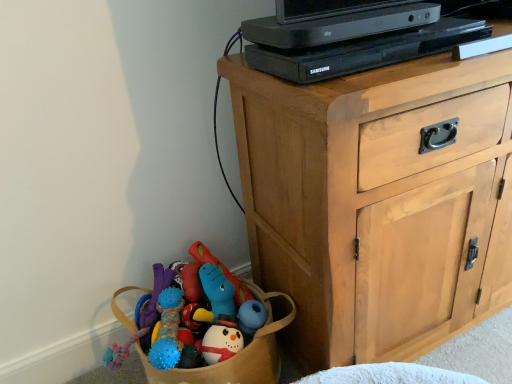
This screenshot has width=512, height=384. Describe the element at coordinates (351, 37) in the screenshot. I see `black plastic computer at upper center` at that location.

Identify the location of black plastic computer at upper center. (351, 37).

In order to click on light wood cabinet at upper right in this screenshot , I will do `click(378, 203)`.

Measure the distance between point (466, 83) and camera.

They are 28.90 inches apart.

What do you see at coordinates (378, 203) in the screenshot? The image size is (512, 384). I see `light wood cabinet at upper right` at bounding box center [378, 203].

What is the approximate width of light wood cabinet at upper right?

45.16 centimeters.

The height and width of the screenshot is (384, 512). In order to click on black plastic computer at upper center in this screenshot , I will do `click(351, 37)`.

Would you say black plastic computer at upper center is to the left or to the right of light wood cabinet at upper right in the picture?

In the image, black plastic computer at upper center appears on the left side of light wood cabinet at upper right.

Does black plastic computer at upper center come behind light wood cabinet at upper right?

Yes, the depth of black plastic computer at upper center is greater than that of light wood cabinet at upper right.

Which is closer to the camera, (294, 45) or (471, 249)?

The point (294, 45) is closer.

From the image's perspective, is black plastic computer at upper center under light wood cabinet at upper right?

No.

From a real-world perspective, which object rests below the other?

light wood cabinet at upper right, from a real-world perspective.

Looking at their sizes, would you say black plastic computer at upper center is wider or thinner than light wood cabinet at upper right?

Clearly, black plastic computer at upper center has less width compared to light wood cabinet at upper right.

Is black plastic computer at upper center taller or shorter than light wood cabinet at upper right?

black plastic computer at upper center is shorter than light wood cabinet at upper right.

Considering the sizes of objects black plastic computer at upper center and light wood cabinet at upper right in the image provided, who is smaller, black plastic computer at upper center or light wood cabinet at upper right?

With smaller size is black plastic computer at upper center.

Based on the photo, is light wood cabinet at upper right located within black plastic computer at upper center?

No, light wood cabinet at upper right is not inside black plastic computer at upper center.

Is black plastic computer at upper center far away from light wood cabinet at upper right?

No, black plastic computer at upper center is not far away from light wood cabinet at upper right.

Is black plastic computer at upper center facing away from light wood cabinet at upper right?

No, black plastic computer at upper center's orientation is not away from light wood cabinet at upper right.

Consider the image. How many degrees apart are the facing directions of black plastic computer at upper center and light wood cabinet at upper right?

1.36 degrees separate the facing orientations of black plastic computer at upper center and light wood cabinet at upper right.

Locate an element on the screen. computer lying above the light wood cabinet at upper right (from the image's perspective) is located at coordinates (351, 37).

Considering the relative positions of light wood cabinet at upper right and black plastic computer at upper center in the image provided, is light wood cabinet at upper right to the left or to the right of black plastic computer at upper center?

Clearly, light wood cabinet at upper right is on the right of black plastic computer at upper center in the image.

Is light wood cabinet at upper right closer to camera compared to black plastic computer at upper center?

Yes, the depth of light wood cabinet at upper right is less than that of black plastic computer at upper center.

Does point (284, 211) come behind point (434, 41)?

Yes, it is behind point (434, 41).

From the image's perspective, is light wood cabinet at upper right positioned above or below black plastic computer at upper center?

light wood cabinet at upper right is below black plastic computer at upper center.

From a real-world perspective, does light wood cabinet at upper right stand above black plastic computer at upper center?

No, from a real-world perspective, light wood cabinet at upper right is not on top of black plastic computer at upper center.

Consider the image. Which object is thinner, light wood cabinet at upper right or black plastic computer at upper center?

Thinner between the two is black plastic computer at upper center.

Considering the sizes of light wood cabinet at upper right and black plastic computer at upper center in the image, is light wood cabinet at upper right taller or shorter than black plastic computer at upper center?

light wood cabinet at upper right is taller than black plastic computer at upper center.

Is light wood cabinet at upper right bigger or smaller than black plastic computer at upper center?

Considering their sizes, light wood cabinet at upper right takes up more space than black plastic computer at upper center.

Is light wood cabinet at upper right not within black plastic computer at upper center?

That's correct, light wood cabinet at upper right is outside of black plastic computer at upper center.

Does light wood cabinet at upper right touch black plastic computer at upper center?

No, light wood cabinet at upper right is not making contact with black plastic computer at upper center.

Is light wood cabinet at upper right oriented away from black plastic computer at upper center?

No, black plastic computer at upper center is not at the back of light wood cabinet at upper right.

How much distance is there between light wood cabinet at upper right and black plastic computer at upper center?

They are 10.58 inches apart.

Locate an element on the screen. the chest of drawers in front of the black plastic computer at upper center is located at coordinates (378, 203).

The height and width of the screenshot is (384, 512). What are the coordinates of `chest of drawers lying on the right of black plastic computer at upper center` in the screenshot? It's located at (378, 203).

You are a GUI agent. You are given a task and a screenshot of the screen. Output one action in this format:
    pyautogui.click(x=<x>, y=<y>)
    Task: Click on the chest of drawers beneath the black plastic computer at upper center (from a real-world perspective)
    Image resolution: width=512 pixels, height=384 pixels.
    Given the screenshot: What is the action you would take?
    pyautogui.click(x=378, y=203)